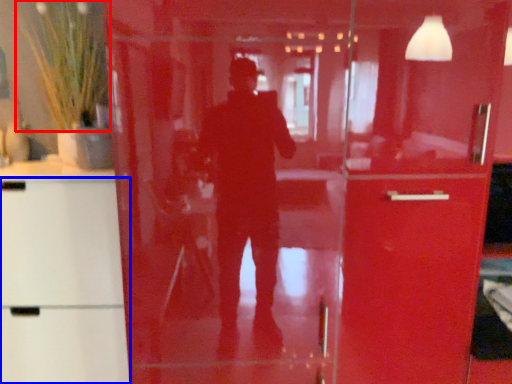
Question: Which object is further to the camera taking this photo, plant (highlighted by a red box) or cabinetry (highlighted by a blue box)?

Choices:
 (A) plant
 (B) cabinetry

Answer: (A)